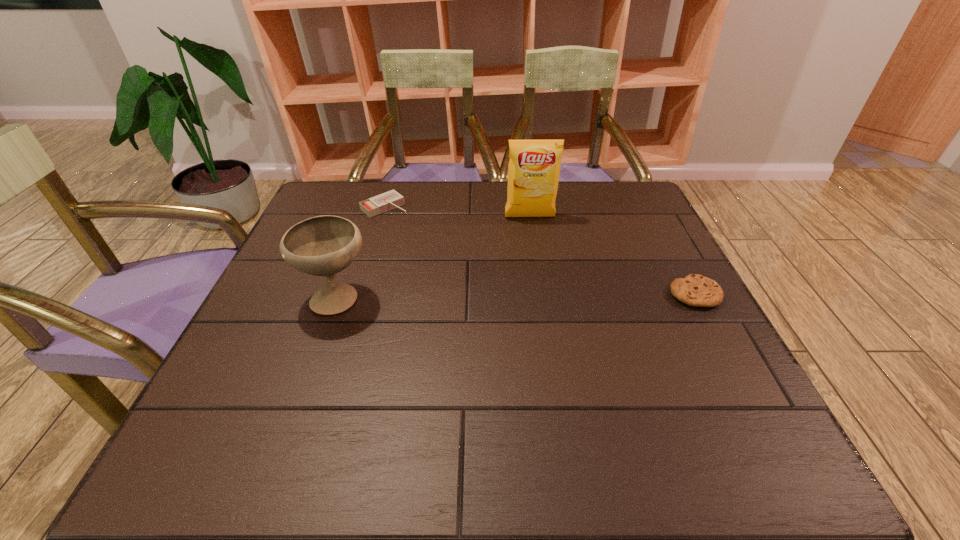
Find the location of a particular element. vacant area that lies between the rightmost object and the matchbox is located at coordinates (540, 251).

I want to click on vacant space in between the rightmost object and the crisp (potato chip), so click(x=612, y=255).

I want to click on blank region between the matchbox and the second tallest object, so click(x=361, y=252).

The width and height of the screenshot is (960, 540). I want to click on free area in between the rightmost object and the matchbox, so click(x=540, y=251).

In order to click on free space between the matchbox and the third shortest object in this screenshot , I will do `click(361, 252)`.

This screenshot has height=540, width=960. What are the coordinates of `empty location between the matchbox and the chalice` in the screenshot? It's located at (361, 252).

The height and width of the screenshot is (540, 960). In order to click on free space that is in between the chalice and the matchbox in this screenshot , I will do `click(361, 252)`.

What are the coordinates of `the closest object to the cookie` in the screenshot? It's located at (534, 167).

I want to click on object that is the third closest to the third shortest object, so click(x=696, y=290).